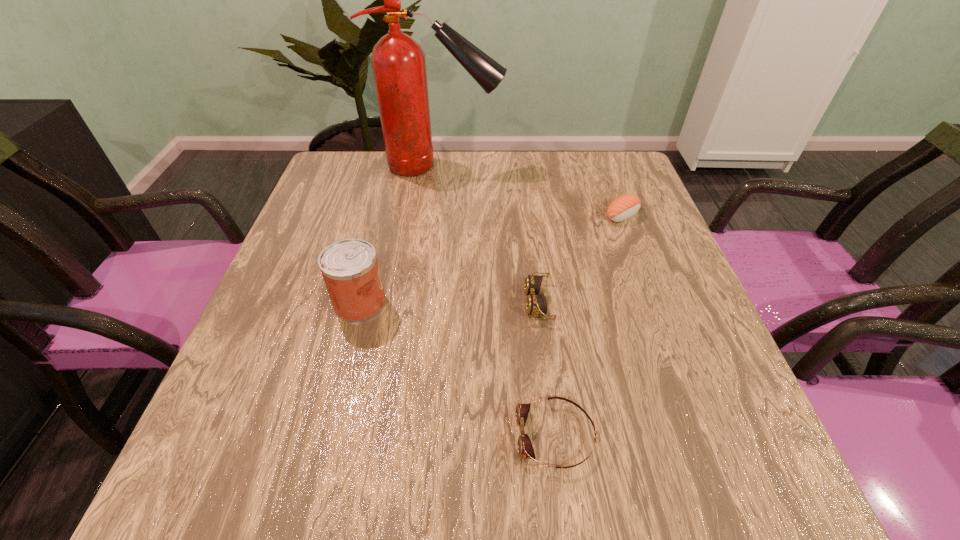
Find the location of a particular element. This screenshot has height=540, width=960. vacant point located 0.360m on the right of the can is located at coordinates (563, 303).

At what (x,y) coordinates should I click in order to perform the action: click on free spot located on the front of the sushi. Please return your answer as a coordinate pair (x, y). Looking at the image, I should click on (636, 253).

This screenshot has height=540, width=960. In order to click on vacant region located 0.260m through the lenses of the second shortest object in this screenshot , I will do `click(397, 303)`.

Find the location of a particular element. The height and width of the screenshot is (540, 960). free spot located through the lenses of the second shortest object is located at coordinates [461, 303].

Find the location of a particular element. vacant region located 0.060m through the lenses of the second shortest object is located at coordinates (495, 303).

This screenshot has width=960, height=540. Identify the location of free space located through the lenses of the nearest object. (322, 436).

Identify the location of vacant region located 0.300m through the lenses of the nearest object. (327, 436).

Locate an element on the screen. This screenshot has height=540, width=960. free location located 0.210m through the lenses of the nearest object is located at coordinates (384, 436).

Locate an element on the screen. This screenshot has height=540, width=960. object positioned at the far edge is located at coordinates 398,62.

You are a GUI agent. You are given a task and a screenshot of the screen. Output one action in this format:
    pyautogui.click(x=<x>, y=<y>)
    Task: Click on the object at the near edge
    This screenshot has height=540, width=960.
    Given the screenshot: What is the action you would take?
    pyautogui.click(x=525, y=449)